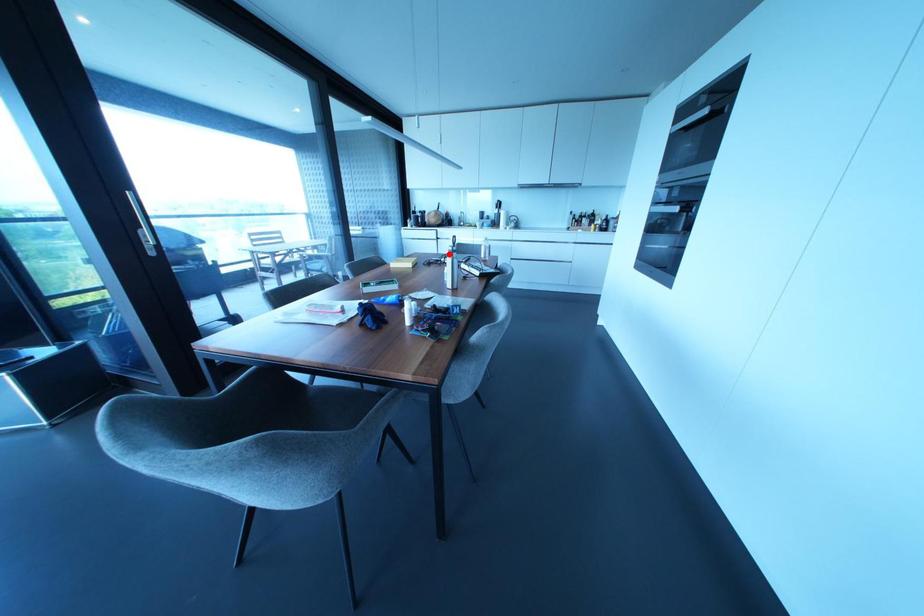
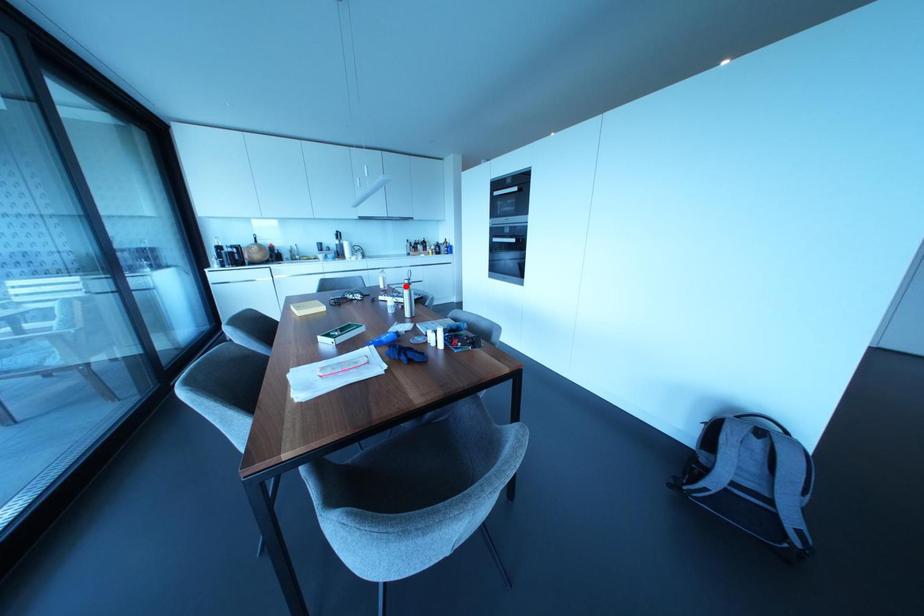
I am providing you with two images of the same scene from different viewpoints. A red point is marked on the first image and another point is marked on the second image. Does the point marked in image1 correspond to the same location as the one in image2?

Yes